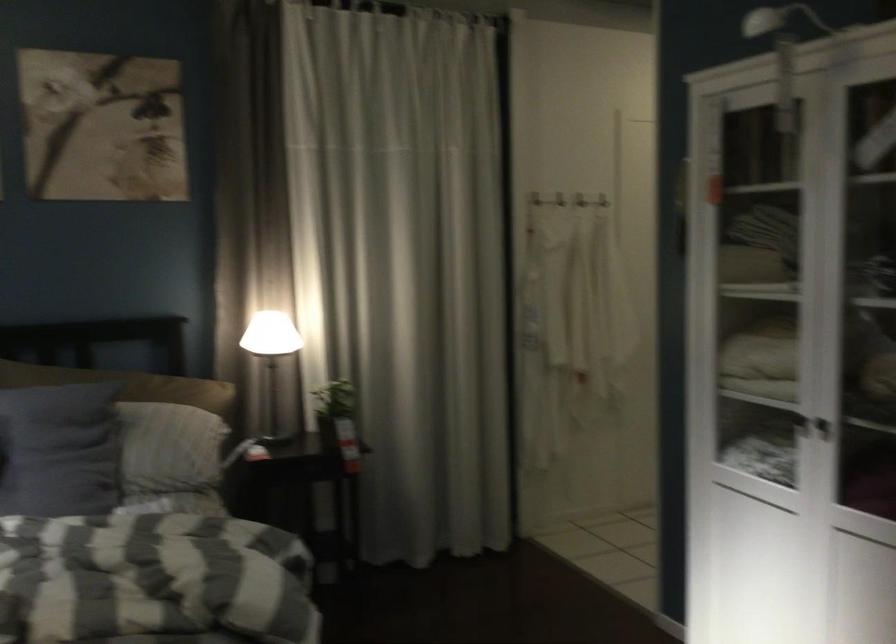
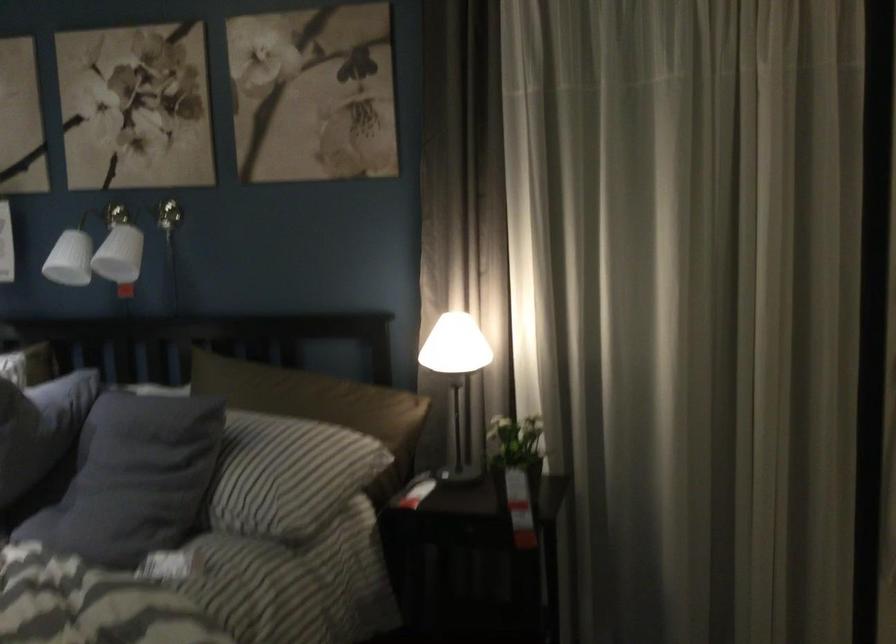
Find the pixel in the second image that matches the point at 170,442 in the first image.

(280, 471)